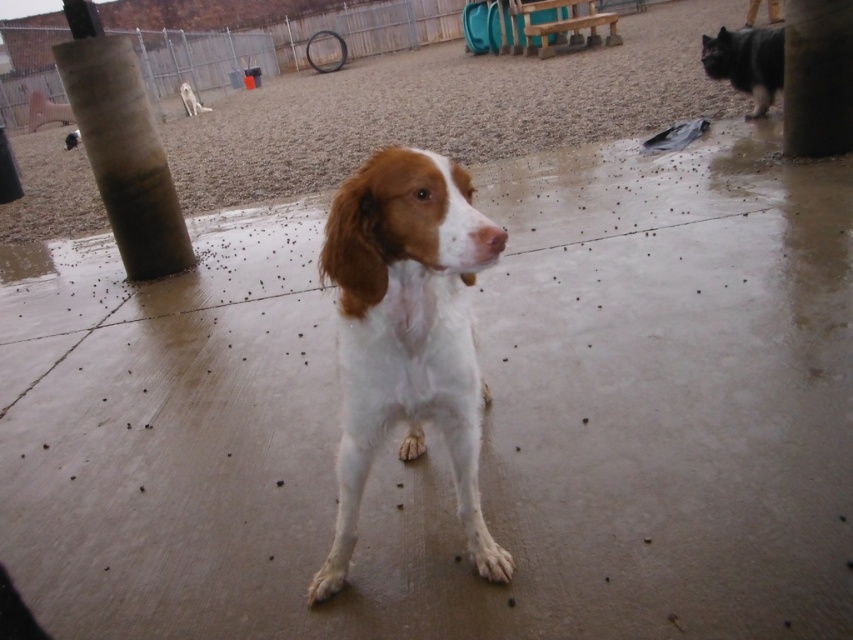
Does point (401, 456) lie behind point (811, 152)?

No, it is not.

Describe the element at coordinates (407, 333) in the screenshot. I see `white matte dog at center` at that location.

Which is in front, point (364, 276) or point (828, 138)?

Positioned in front is point (364, 276).

Where is `white matte dog at center`? white matte dog at center is located at coordinates (407, 333).

Does concrete textured pillar at center have a greater width compared to dark brown fur dog at upper right?

No, concrete textured pillar at center is not wider than dark brown fur dog at upper right.

Which is in front, point (825, 54) or point (712, 54)?

Point (825, 54) is in front.

Describe the element at coordinates (817, 77) in the screenshot. Image resolution: width=853 pixels, height=640 pixels. I see `concrete textured pillar at center` at that location.

At what (x,y) coordinates should I click in order to perform the action: click on concrete textured pillar at center. Please return your answer as a coordinate pair (x, y). This screenshot has width=853, height=640. Looking at the image, I should click on (817, 77).

Between concrete textured pillar at left and dark brown fur dog at upper right, which one is positioned higher?

dark brown fur dog at upper right is higher up.

Between concrete textured pillar at left and dark brown fur dog at upper right, which one has less height?

dark brown fur dog at upper right is shorter.

This screenshot has height=640, width=853. I want to click on concrete textured pillar at left, so click(122, 147).